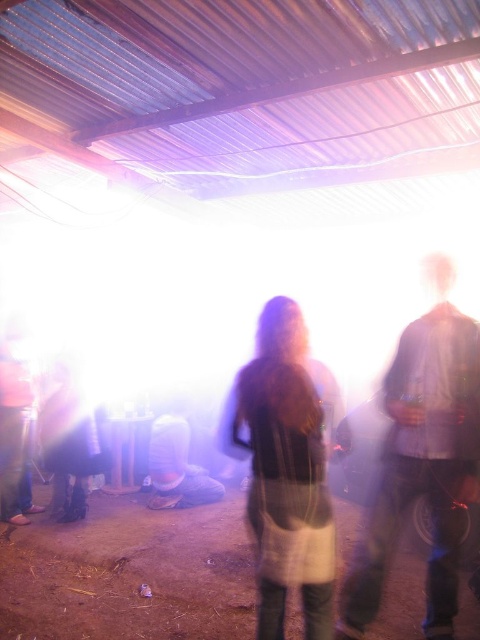
You are a photographer trying to capture a clear shot of the light brown fabric dress at center and the shiny black boots at lower left. Since the lighting is too bright, you decide to adjust your camera settings. Which object should you focus on first if you want to ensure both are in focus?

The light brown fabric dress at center is taller than the shiny black boots at lower left, so focusing on the light brown fabric dress at center first would help ensure both are in focus as it is the farther object.

You are standing at the entrance of the gathering and want to locate the light brown fabric dress at center. According to the coordinates provided, in which direction should you look to find it?

The light brown fabric dress at center is located at coordinates point [284,467], which is towards the lower right direction from your current position at the entrance.

You are a photographer adjusting your camera settings in this bright environment. You want to focus on the person at point [61,381] and the person at point [180,435]. Which person will be in sharper focus if you focus on the closer one?

The person at point [61,381] will be in sharper focus because it is closer to the camera than the person at point [180,435].